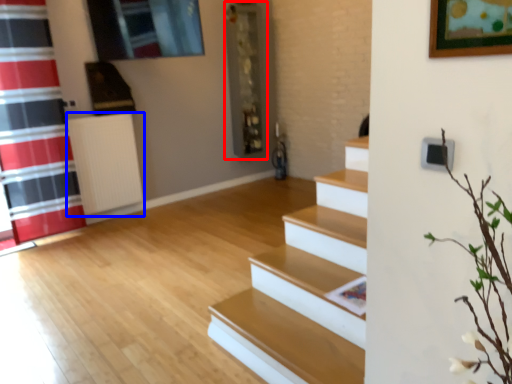
Question: Which object appears closest to the camera in this image, shelf (highlighted by a red box) or radiator (highlighted by a blue box)?

Choices:
 (A) shelf
 (B) radiator

Answer: (B)